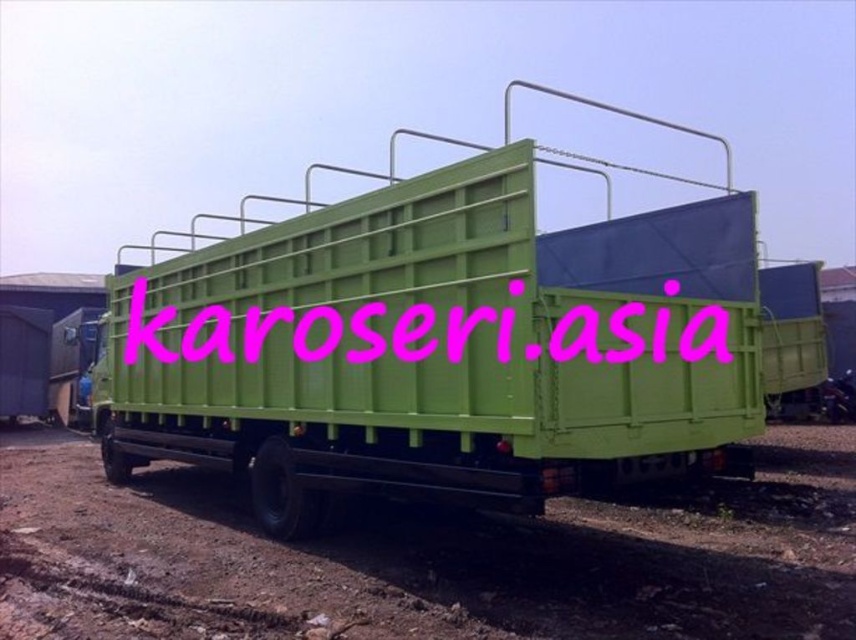
You are a delivery driver who needs to load a large package onto the truck. You see the green matte truck at center and the pink matte text at center. Which object is larger and should you focus on for loading the package?

The green matte truck at center is bigger than the pink matte text at center, so you should focus on the green matte truck at center for loading the package since it is the larger object.

You are a delivery driver who needs to park your truck exactly 5 meters away from the pink matte text at center. Currently, your truck is parked at the dirt track at lower center. Can you move forward or backward to achieve the required distance?

The current distance between the dirt track at lower center and the pink matte text at center is 4.58 meters. To reach the required 5 meters, you should move your truck slightly forward from the dirt track at lower center towards the pink matte text at center, as this will increase the distance by approximately 0.42 meters.

You are a delivery driver who needs to park your green matte truck at center in a specific spot marked at coordinates 0.5, 0.5. Based on the image, is the truck currently parked within the designated area?

The 2D location of the green matte truck at center is at point (461, 344), which is very close to the designated spot at (428, 320). Therefore, the truck is parked within the designated area.